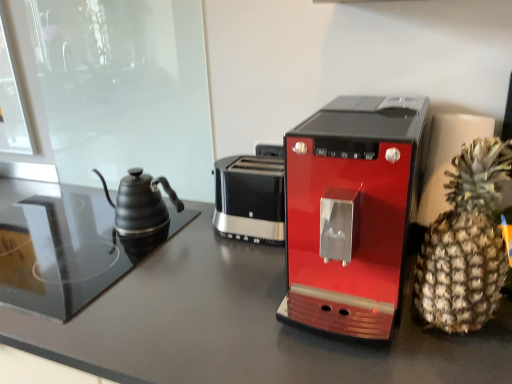
Locate an element on the screen. vacant area that lies between black plastic toaster at center and shiny red coffee maker at center is located at coordinates (242, 271).